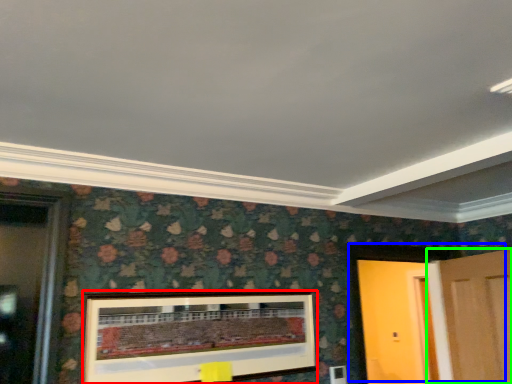
Question: Based on their relative distances, which object is farther from picture frame (highlighted by a red box)? Choose from door (highlighted by a blue box) and door (highlighted by a green box).

Choices:
 (A) door
 (B) door

Answer: (B)